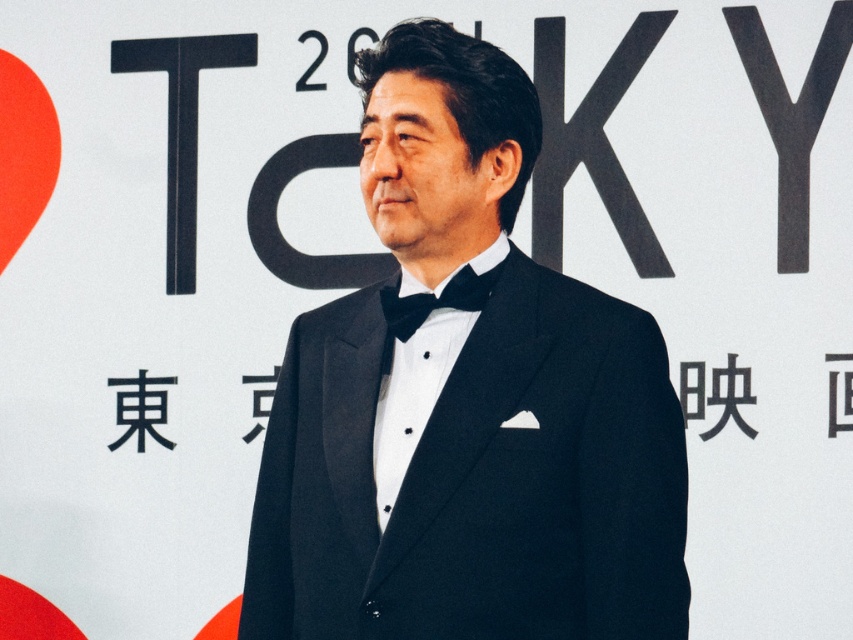
Question: Does black satin tuxedo at center appear over black satin bow tie at center?

Choices:
 (A) no
 (B) yes

Answer: (A)

Question: From the image, what is the correct spatial relationship of black satin tuxedo at center in relation to black satin bow tie at center?

Choices:
 (A) below
 (B) above

Answer: (A)

Question: Which point is closer to the camera?

Choices:
 (A) (383, 481)
 (B) (422, 310)

Answer: (A)

Question: Is black satin tuxedo at center to the right of black satin bow tie at center from the viewer's perspective?

Choices:
 (A) yes
 (B) no

Answer: (A)

Question: Which point is farther to the camera?

Choices:
 (A) (381, 440)
 (B) (442, 301)

Answer: (B)

Question: Which object is closer to the camera taking this photo?

Choices:
 (A) black satin tuxedo at center
 (B) black satin bow tie at center

Answer: (A)